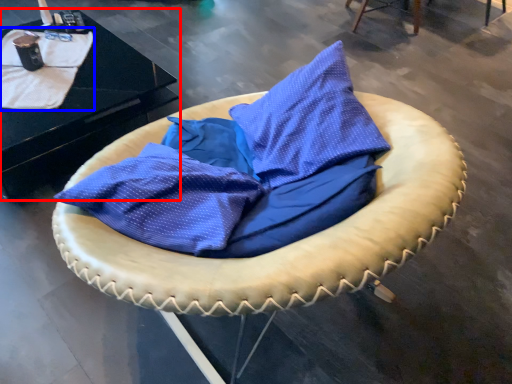
Question: Which point is further to the camera, table (highlighted by a red box) or blanket (highlighted by a blue box)?

Choices:
 (A) table
 (B) blanket

Answer: (B)